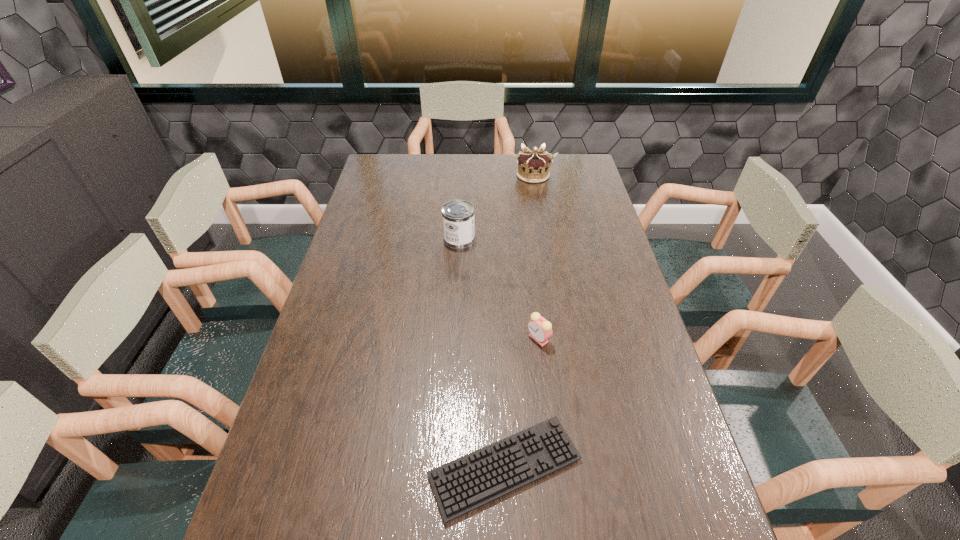
What are the coordinates of `vacant space that satisfies the following two spatial constraints: 1. on the back side of the can; 2. on the right side of the crown` in the screenshot? It's located at (463, 175).

Locate an element on the screen. This screenshot has height=540, width=960. free space that satisfies the following two spatial constraints: 1. on the front side of the computer keyboard; 2. on the right side of the can is located at coordinates (x=446, y=467).

Locate an element on the screen. vacant region that satisfies the following two spatial constraints: 1. on the front side of the crown; 2. on the face of the alarm clock is located at coordinates (560, 339).

Find the location of a particular element. This screenshot has height=540, width=960. free location that satisfies the following two spatial constraints: 1. on the back side of the can; 2. on the right side of the crown is located at coordinates (463, 175).